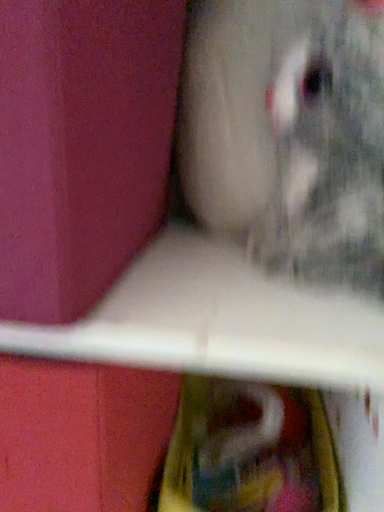
Describe the element at coordinates (82, 146) in the screenshot. The width and height of the screenshot is (384, 512). I see `matte pink box at left` at that location.

Where is `matte pink box at left`? The image size is (384, 512). matte pink box at left is located at coordinates (82, 146).

This screenshot has width=384, height=512. I want to click on fuzzy gray cat at upper right, so click(x=289, y=133).

Image resolution: width=384 pixels, height=512 pixels. What do you see at coordinates (289, 133) in the screenshot?
I see `fuzzy gray cat at upper right` at bounding box center [289, 133].

Measure the distance between point (348,170) and camera.

Point (348,170) and camera are 13.66 inches apart.

Locate an element on the screen. This screenshot has width=384, height=512. matte pink box at left is located at coordinates (82, 146).

Based on the photo, between fuzzy gray cat at upper right and matte pink box at left, which one appears on the right side from the viewer's perspective?

Positioned to the right is fuzzy gray cat at upper right.

Is fuzzy gray cat at upper right positioned behind matte pink box at left?

Yes.

Which is less distant, (315, 63) or (106, 128)?

Point (315, 63) is positioned farther from the camera compared to point (106, 128).

From the image's perspective, is fuzzy gray cat at upper right located above matte pink box at left?

No, from the image's perspective, fuzzy gray cat at upper right is not on top of matte pink box at left.

From a real-world perspective, is fuzzy gray cat at upper right under matte pink box at left?

Yes, from a real-world perspective, fuzzy gray cat at upper right is beneath matte pink box at left.

Based on the photo, considering the sizes of fuzzy gray cat at upper right and matte pink box at left in the image, is fuzzy gray cat at upper right wider or thinner than matte pink box at left?

fuzzy gray cat at upper right is thinner than matte pink box at left.

From their relative heights in the image, would you say fuzzy gray cat at upper right is taller or shorter than matte pink box at left?

In the image, fuzzy gray cat at upper right appears to be taller than matte pink box at left.

Considering the relative sizes of fuzzy gray cat at upper right and matte pink box at left in the image provided, is fuzzy gray cat at upper right smaller than matte pink box at left?

Yes, fuzzy gray cat at upper right is smaller than matte pink box at left.

Is fuzzy gray cat at upper right situated inside matte pink box at left or outside?

fuzzy gray cat at upper right is located beyond the bounds of matte pink box at left.

Is fuzzy gray cat at upper right with matte pink box at left?

No, fuzzy gray cat at upper right is not next to matte pink box at left.

Does fuzzy gray cat at upper right turn towards matte pink box at left?

No, fuzzy gray cat at upper right is not facing towards matte pink box at left.

How different are the orientations of fuzzy gray cat at upper right and matte pink box at left in degrees?

0.00032 degrees separate the facing orientations of fuzzy gray cat at upper right and matte pink box at left.

How far apart are fuzzy gray cat at upper right and matte pink box at left?

5.23 inches.

The width and height of the screenshot is (384, 512). Identify the location of box located above the fuzzy gray cat at upper right (from a real-world perspective). (82, 146).

Between matte pink box at left and fuzzy gray cat at upper right, which one appears on the left side from the viewer's perspective?

matte pink box at left.

Is matte pink box at left closer to camera compared to fuzzy gray cat at upper right?

Yes, it is.

Which point is more forward, [16,202] or [301,90]?

The point [16,202] is closer to the camera.

From the image's perspective, is matte pink box at left above fuzzy gray cat at upper right?

Yes.

From a real-world perspective, who is located higher, matte pink box at left or fuzzy gray cat at upper right?

matte pink box at left, from a real-world perspective.

From the picture: Considering the relative sizes of matte pink box at left and fuzzy gray cat at upper right in the image provided, is matte pink box at left wider than fuzzy gray cat at upper right?

Yes, matte pink box at left is wider than fuzzy gray cat at upper right.

Is matte pink box at left taller than fuzzy gray cat at upper right?

In fact, matte pink box at left may be shorter than fuzzy gray cat at upper right.

Considering the sizes of objects matte pink box at left and fuzzy gray cat at upper right in the image provided, who is smaller, matte pink box at left or fuzzy gray cat at upper right?

fuzzy gray cat at upper right is smaller.

Is matte pink box at left completely or partially outside of fuzzy gray cat at upper right?

Indeed, matte pink box at left is completely outside fuzzy gray cat at upper right.

Is matte pink box at left next to fuzzy gray cat at upper right?

No, matte pink box at left is not beside fuzzy gray cat at upper right.

Is matte pink box at left oriented away from fuzzy gray cat at upper right?

matte pink box at left does not have its back to fuzzy gray cat at upper right.

How distant is matte pink box at left from fuzzy gray cat at upper right?

They are 5.23 inches apart.

The image size is (384, 512). I want to click on animal on the right of matte pink box at left, so click(x=289, y=133).

Locate an element on the screen. Image resolution: width=384 pixels, height=512 pixels. animal behind the matte pink box at left is located at coordinates (289, 133).

Locate an element on the screen. box above the fuzzy gray cat at upper right (from a real-world perspective) is located at coordinates (82, 146).